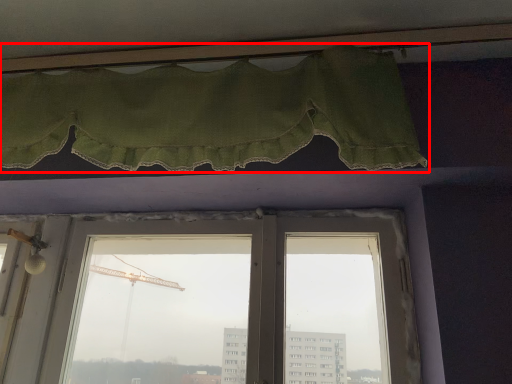
Question: In this image, where is curtain (annotated by the red box) located relative to window?

Choices:
 (A) right
 (B) left

Answer: (B)